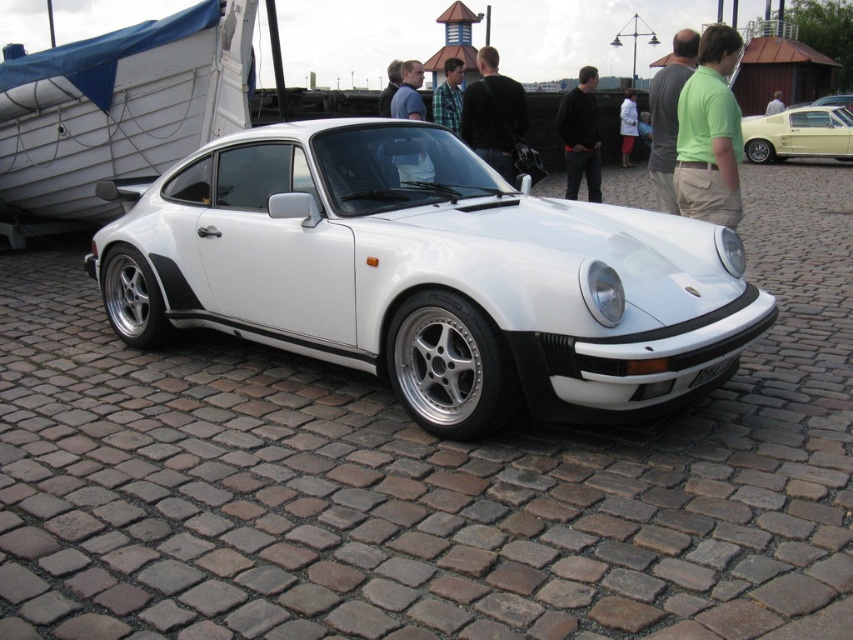
Who is positioned more to the right, light yellow matte car at upper right or matte blue shirt at center?

Positioned to the right is light yellow matte car at upper right.

Is point (831, 106) in front of point (409, 116)?

That is False.

In order to click on light yellow matte car at upper right in this screenshot , I will do `click(798, 134)`.

Who is higher up, white wood boat at left or matte blue shirt at center?

Positioned higher is white wood boat at left.

Does white wood boat at left have a smaller size compared to matte blue shirt at center?

Correct, white wood boat at left occupies less space than matte blue shirt at center.

Is point (178, 29) positioned behind point (416, 176)?

Yes, point (178, 29) is behind point (416, 176).

This screenshot has height=640, width=853. I want to click on white wood boat at left, so click(x=120, y=106).

Does white glossy sports car at center appear on the left side of white plastic license plate at center?

Yes, white glossy sports car at center is to the left of white plastic license plate at center.

Is point (677, 230) positioned after point (718, 369)?

Yes, it is.

Where is `white glossy sports car at center`? This screenshot has width=853, height=640. white glossy sports car at center is located at coordinates (426, 275).